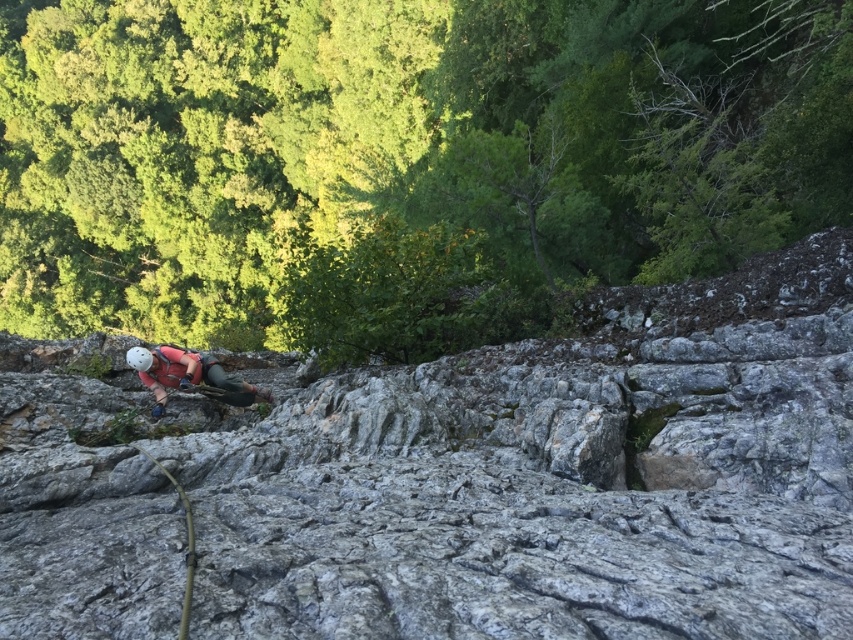
Is matte pink climbing harness at center to the left of greenish-gray rubber rope at lower left from the viewer's perspective?

Yes, matte pink climbing harness at center is to the left of greenish-gray rubber rope at lower left.

In order to click on matte pink climbing harness at center in this screenshot , I will do `click(189, 376)`.

Describe the element at coordinates (189, 376) in the screenshot. I see `matte pink climbing harness at center` at that location.

This screenshot has width=853, height=640. Find the location of `matte pink climbing harness at center`. matte pink climbing harness at center is located at coordinates (189, 376).

Is point (740, 566) in front of point (181, 500)?

Yes, point (740, 566) is in front of point (181, 500).

Does gray rough rock at center have a larger size compared to greenish-gray rubber rope at lower left?

Actually, gray rough rock at center might be smaller than greenish-gray rubber rope at lower left.

Which is in front, point (608, 595) or point (148, 456)?

Point (608, 595) is more forward.

Where is `gray rough rock at center`? This screenshot has height=640, width=853. gray rough rock at center is located at coordinates (457, 481).

Based on the photo, is gray rough rock at center below matte pink climbing harness at center?

Correct, gray rough rock at center is located below matte pink climbing harness at center.

Where is `gray rough rock at center`? Image resolution: width=853 pixels, height=640 pixels. gray rough rock at center is located at coordinates (457, 481).